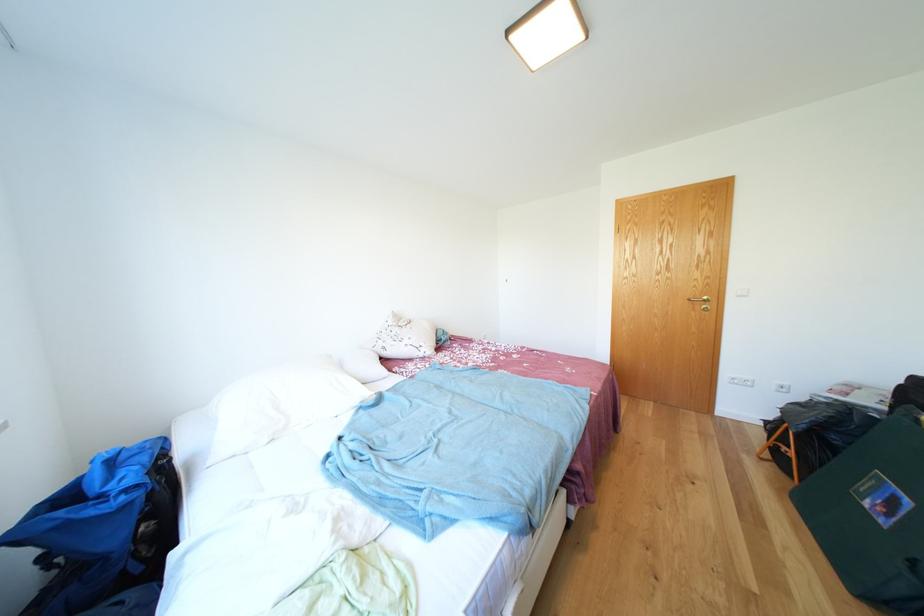
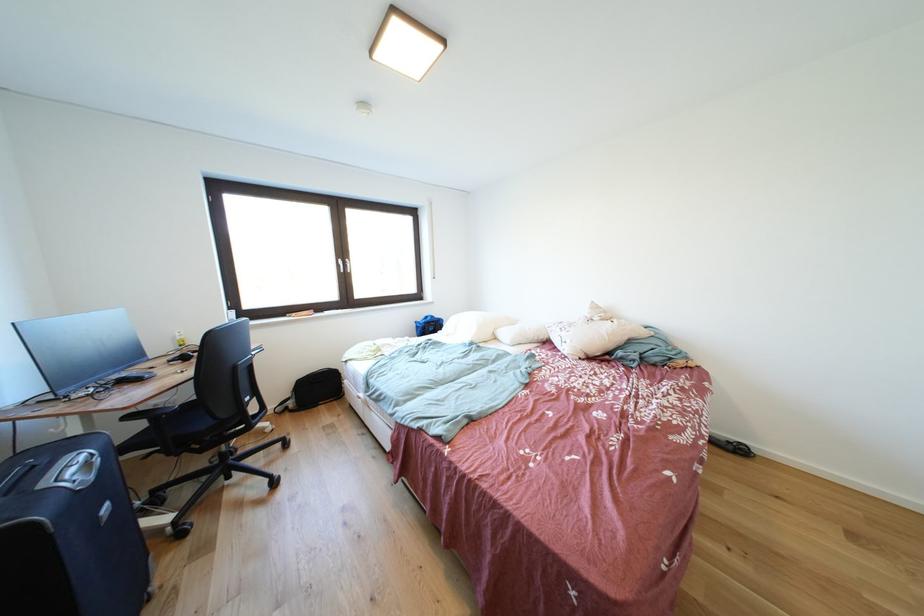
Where in the second image is the point corresponding to [416,346] from the first image?

(572, 338)